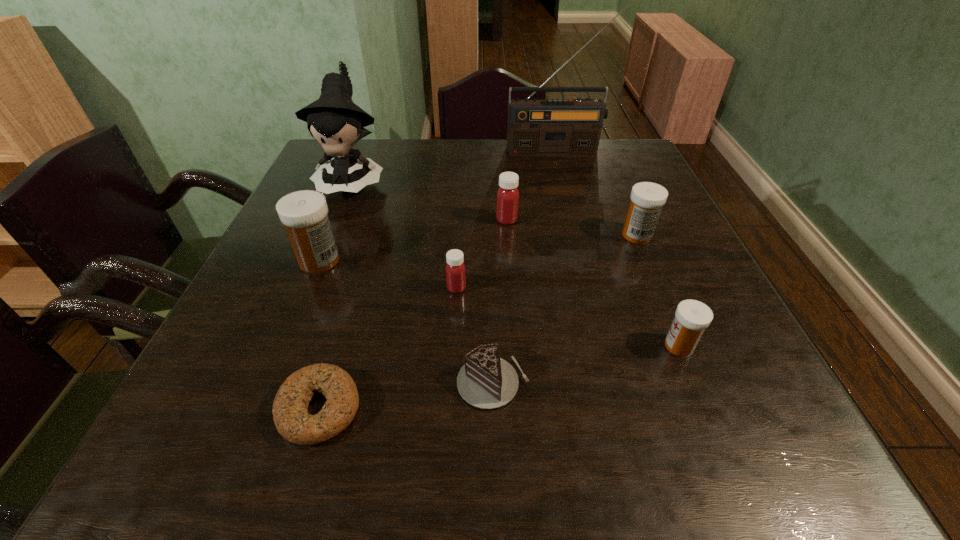
Where is `object that is the fourth closest to the third farthest medicine`? This screenshot has height=540, width=960. object that is the fourth closest to the third farthest medicine is located at coordinates (486, 381).

Where is `medicine that stands as the second closest to the second smallest white medicine`? Image resolution: width=960 pixels, height=540 pixels. medicine that stands as the second closest to the second smallest white medicine is located at coordinates (692, 317).

Find the location of a particular element. This screenshot has width=960, height=540. the third closest medicine to the second biggest white medicine is located at coordinates (455, 269).

At what (x,y) coordinates should I click in order to perform the action: click on white medicine that is the second closest to the fourth farthest medicine. Please return your answer as a coordinate pair (x, y). Looking at the image, I should click on (692, 317).

Select which white medicine is the closest to the smallest white medicine. Please provide its 2D coordinates. Your answer should be formatted as a tuple, i.e. [(x, y)], where the tuple contains the x and y coordinates of a point satisfying the conditions above.

[(647, 199)]

Image resolution: width=960 pixels, height=540 pixels. In order to click on free location that satisfies the following two spatial constraints: 1. on the back side of the chocolate cake; 2. on the left side of the second biggest white medicine in this screenshot , I will do coord(490,235).

You are a GUI agent. You are given a task and a screenshot of the screen. Output one action in this format:
    pyautogui.click(x=<x>, y=<y>)
    Task: Click on the vacant region that satisfies the following two spatial constraints: 1. on the back side of the bagel; 2. on the left side of the nearest white medicine
    The width and height of the screenshot is (960, 540).
    Given the screenshot: What is the action you would take?
    pyautogui.click(x=338, y=346)

I want to click on free point that satisfies the following two spatial constraints: 1. at the face of the second tallest object; 2. on the right side of the nearest medicine, so click(x=287, y=346).